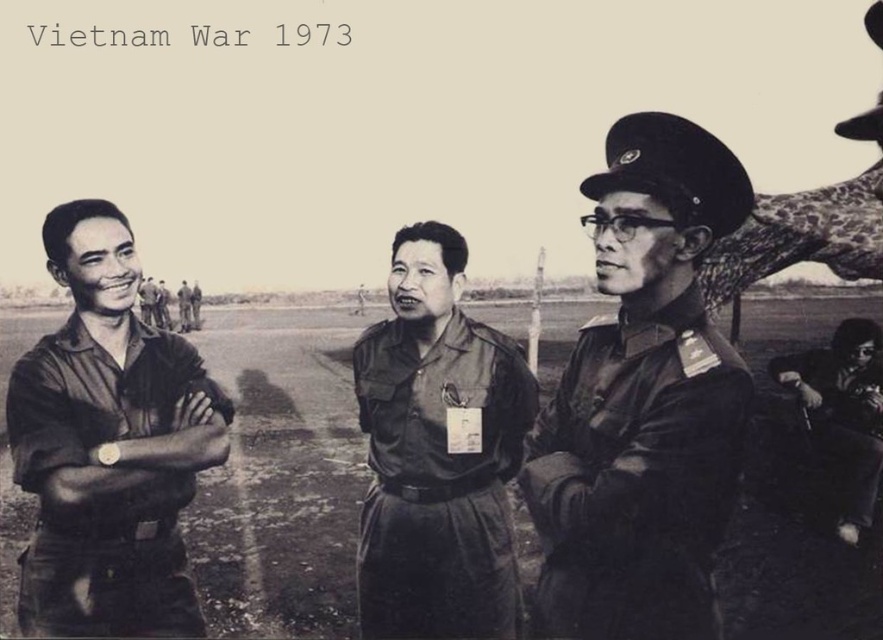
Question: Which of the following is the farthest from the observer?

Choices:
 (A) pos(87,480)
 (B) pos(482,582)
 (C) pos(779,372)

Answer: (C)

Question: Is dark olive-green fabric military uniform at center to the left of dark green fabric uniform at lower right from the viewer's perspective?

Choices:
 (A) no
 (B) yes

Answer: (B)

Question: Which point appears closest to the camera in this image?

Choices:
 (A) (25, 458)
 (B) (693, 355)
 (C) (476, 611)
 (D) (866, 385)

Answer: (B)

Question: Can you confirm if dark olive-green fabric military uniform at center is thinner than matte khaki uniform at center?

Choices:
 (A) yes
 (B) no

Answer: (B)

Question: Which of the following is the closest to the observer?

Choices:
 (A) matte khaki uniform at center
 (B) matte khaki shirt at left
 (C) dark olive-green fabric military uniform at center
 (D) matte dark green uniform at center

Answer: (C)

Question: Is dark olive-green fabric military uniform at center in front of matte khaki shirt at left?

Choices:
 (A) yes
 (B) no

Answer: (A)